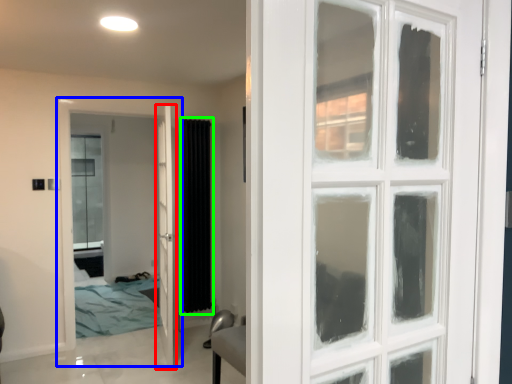
Question: Which is farther away from door (highlighted by a red box)? door (highlighted by a blue box) or curtain (highlighted by a green box)?

Choices:
 (A) door
 (B) curtain

Answer: (B)